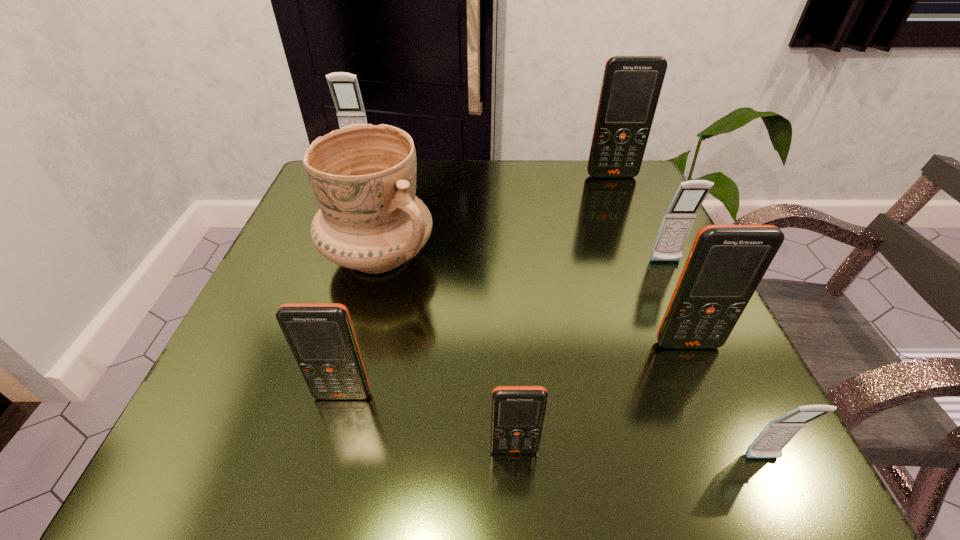
Identify the location of free space between the fifth object from right to left and the sixth nearest cellular telephone. The height and width of the screenshot is (540, 960). (563, 313).

Find the location of `free area in between the second farthest orange cellular telephone and the farthest object`. free area in between the second farthest orange cellular telephone and the farthest object is located at coordinates (524, 254).

Find the location of a particular element. The width and height of the screenshot is (960, 540). free space between the fifth nearest cellular telephone and the biggest gray cellular telephone is located at coordinates (513, 213).

Locate an element on the screen. The width and height of the screenshot is (960, 540). free spot between the fifth nearest cellular telephone and the second smallest orange cellular telephone is located at coordinates (504, 328).

In order to click on unoccupied position between the tallest cellular telephone and the second biggest orange cellular telephone in this screenshot , I will do tap(650, 260).

Locate an element on the screen. This screenshot has width=960, height=540. free spot between the beige pottery and the smallest gray cellular telephone is located at coordinates (570, 357).

This screenshot has height=540, width=960. What are the coordinates of `vacant region between the fifth cellular telephone from right to left and the farthest object` in the screenshot? It's located at (437, 307).

In order to click on free space between the beige pottery and the fifth nearest cellular telephone in this screenshot , I will do `click(522, 259)`.

Locate an element on the screen. The width and height of the screenshot is (960, 540). object that is the third closest to the fifth farthest cellular telephone is located at coordinates (726, 263).

Where is `the fourth closest object to the leftmost orange cellular telephone`? the fourth closest object to the leftmost orange cellular telephone is located at coordinates (777, 433).